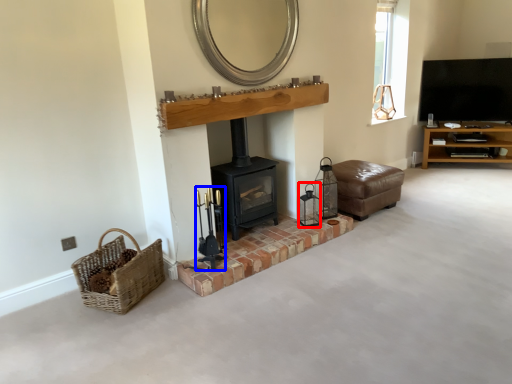
Question: Among these objects, which one is farthest to the camera, candle holder (highlighted by a red box) or candle holder (highlighted by a blue box)?

Choices:
 (A) candle holder
 (B) candle holder

Answer: (A)